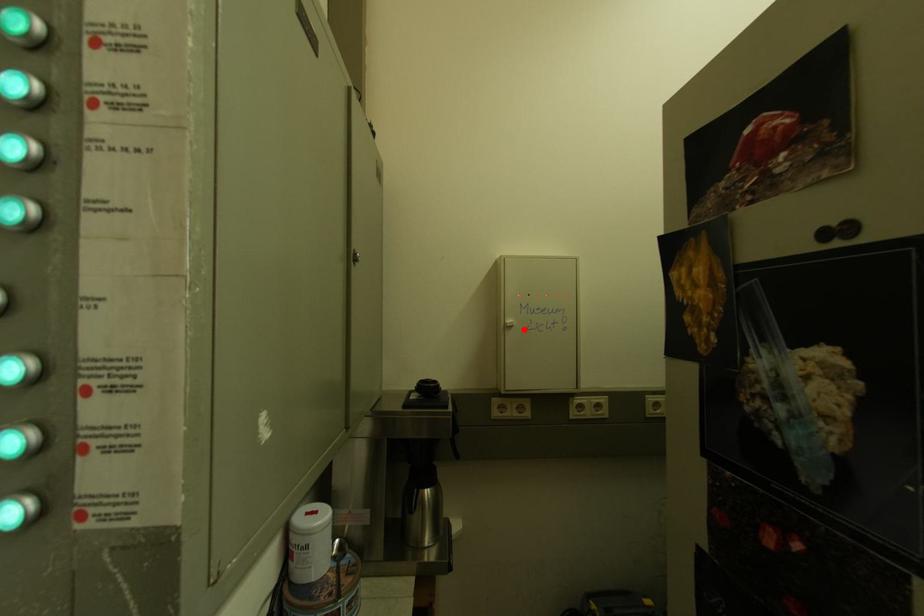
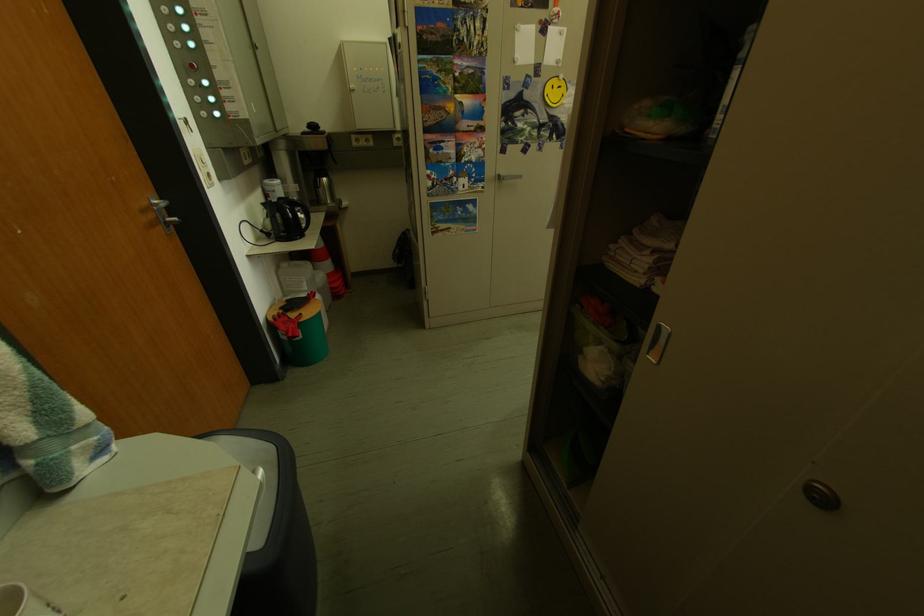
In the second image, find the point that corresponds to the highlighted location in the first image.

(367, 92)